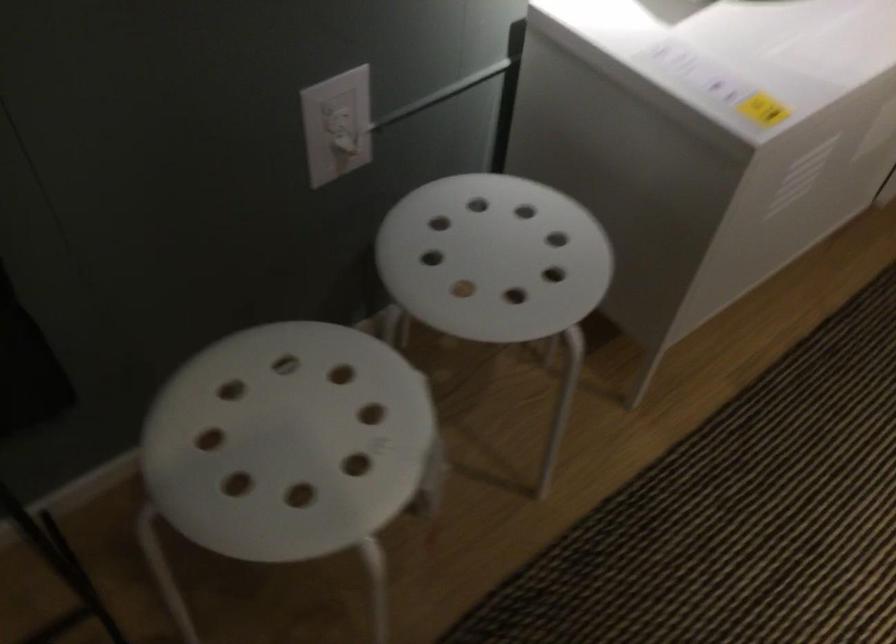
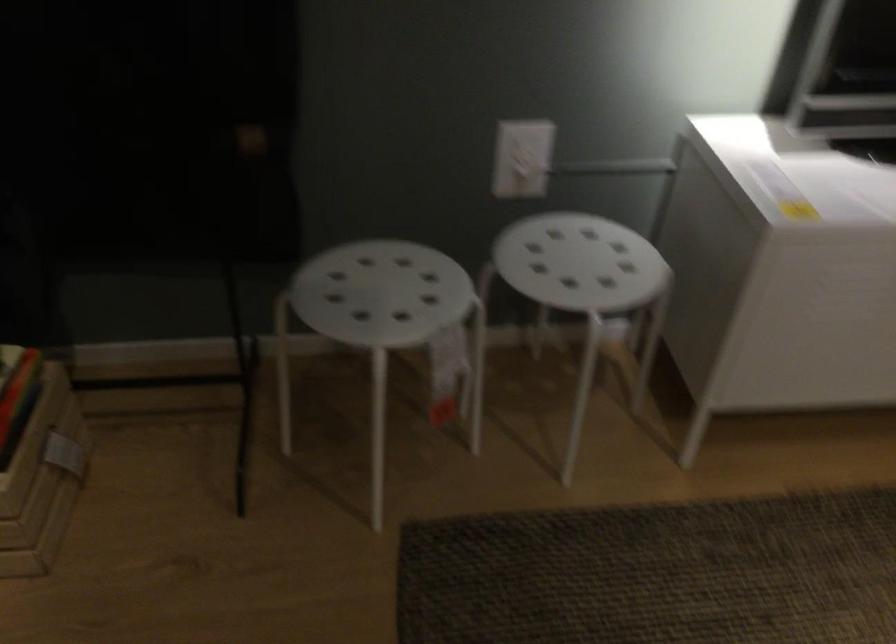
Question: The first image is from the beginning of the video and the second image is from the end. How did the camera likely rotate when shooting the video?

Choices:
 (A) Left
 (B) Right
 (C) Up
 (D) Down

Answer: (A)